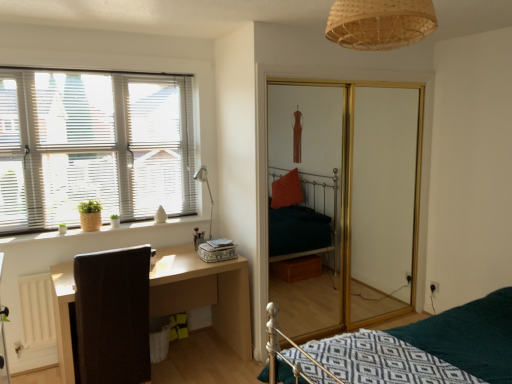
Question: Is matte silver table lamp at upper left far away from wooden window sill at left?

Choices:
 (A) no
 (B) yes

Answer: (A)

Question: From the image's perspective, is matte silver table lamp at upper left under wooden window sill at left?

Choices:
 (A) no
 (B) yes

Answer: (A)

Question: Is matte silver table lamp at upper left closer to the viewer compared to wooden window sill at left?

Choices:
 (A) yes
 (B) no

Answer: (B)

Question: Is matte silver table lamp at upper left bigger than wooden window sill at left?

Choices:
 (A) yes
 (B) no

Answer: (A)

Question: Could you tell me if matte silver table lamp at upper left is turned towards wooden window sill at left?

Choices:
 (A) no
 (B) yes

Answer: (A)

Question: Is matte silver table lamp at upper left oriented away from wooden window sill at left?

Choices:
 (A) yes
 (B) no

Answer: (B)

Question: From the image's perspective, would you say light wood/dark brown desk at lower left is positioned over wooden window sill at left?

Choices:
 (A) yes
 (B) no

Answer: (B)

Question: Does light wood/dark brown desk at lower left have a lesser width compared to wooden window sill at left?

Choices:
 (A) yes
 (B) no

Answer: (B)

Question: Is light wood/dark brown desk at lower left closer to the viewer compared to wooden window sill at left?

Choices:
 (A) yes
 (B) no

Answer: (A)

Question: Does light wood/dark brown desk at lower left appear on the right side of wooden window sill at left?

Choices:
 (A) no
 (B) yes

Answer: (B)

Question: Considering the relative sizes of light wood/dark brown desk at lower left and wooden window sill at left in the image provided, is light wood/dark brown desk at lower left wider than wooden window sill at left?

Choices:
 (A) yes
 (B) no

Answer: (A)

Question: From a real-world perspective, is light wood/dark brown desk at lower left physically above wooden window sill at left?

Choices:
 (A) no
 (B) yes

Answer: (A)

Question: From the image's perspective, is brown leather swivel chair at left beneath wooden window sill at left?

Choices:
 (A) yes
 (B) no

Answer: (A)